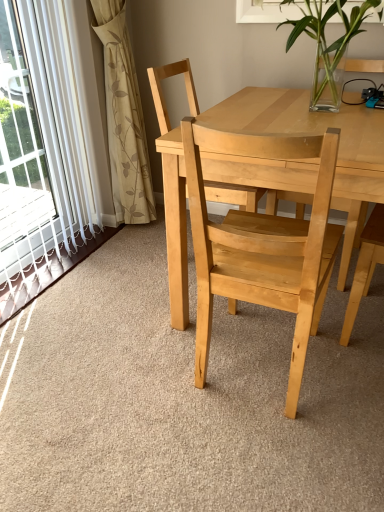
Question: Is beige floral fabric curtain at left to the left or to the right of natural wood chair at center, marked as the 2th chair in a front-to-back arrangement, in the image?

Choices:
 (A) right
 (B) left

Answer: (B)

Question: Would you say beige floral fabric curtain at left is inside or outside natural wood chair at center, marked as the 2th chair in a front-to-back arrangement?

Choices:
 (A) inside
 (B) outside

Answer: (B)

Question: Which object is positioned farthest from the natural wood chair at center, the 2th chair when ordered from back to front?

Choices:
 (A) clear glass vase at upper center
 (B) beige floral fabric curtain at left
 (C) natural wood chair at center, marked as the 2th chair in a front-to-back arrangement

Answer: (B)

Question: Considering the real-world distances, which object is closest to the beige floral fabric curtain at left?

Choices:
 (A) natural wood chair at center, placed as the first chair when sorted from front to back
 (B) clear glass vase at upper center
 (C) natural wood chair at center, the 1th chair viewed from the back

Answer: (C)